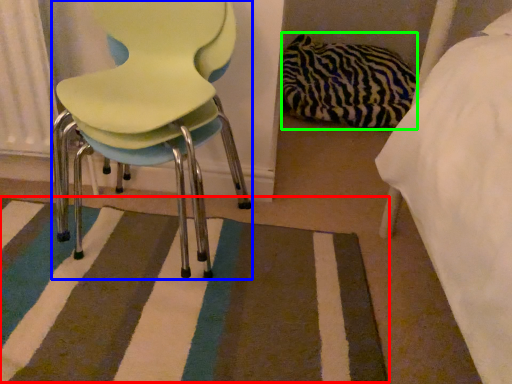
Question: Based on their relative distances, which object is farther from mat (highlighted by a red box)? Choose from chair (highlighted by a blue box) and material (highlighted by a green box).

Choices:
 (A) chair
 (B) material

Answer: (B)